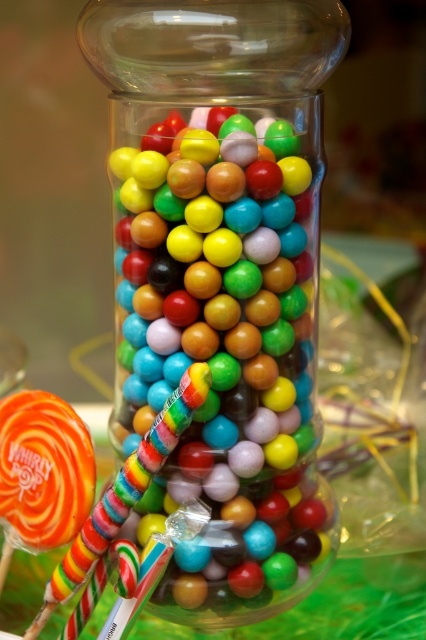
You are holding a candy jar and want to place a new candy at point (293, 310). The candy has a diameter of 1 inch. Can you fit it there without overlapping with other candies?

The point (293, 310) is 10.89 inches away from the viewer. Since the candy has a diameter of 1 inch, there is sufficient space to place it without overlapping with other candies.

You are holding a candy cane that is 6 inches long and want to place it inside the transparent glass jar at center. Can the candy cane fit inside the jar?

The transparent glass jar at center is 9.18 inches from the camera, so the candy cane that is 6 inches long can fit inside the jar since it is shorter than the jar.

You are trying to place the multicolored striped lollipop at lower left into the transparent glass jar at center. Based on their sizes, will the lollipop fit inside the jar?

The transparent glass jar at center is wider than the multicolored striped lollipop at lower left, so the lollipop should fit inside the jar.